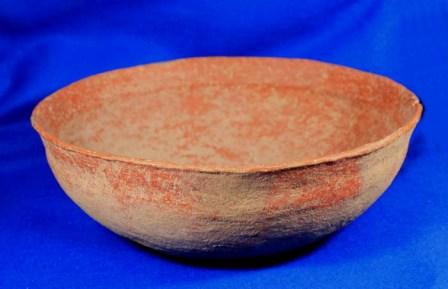
I want to click on edge of the bowl, so click(333, 153).